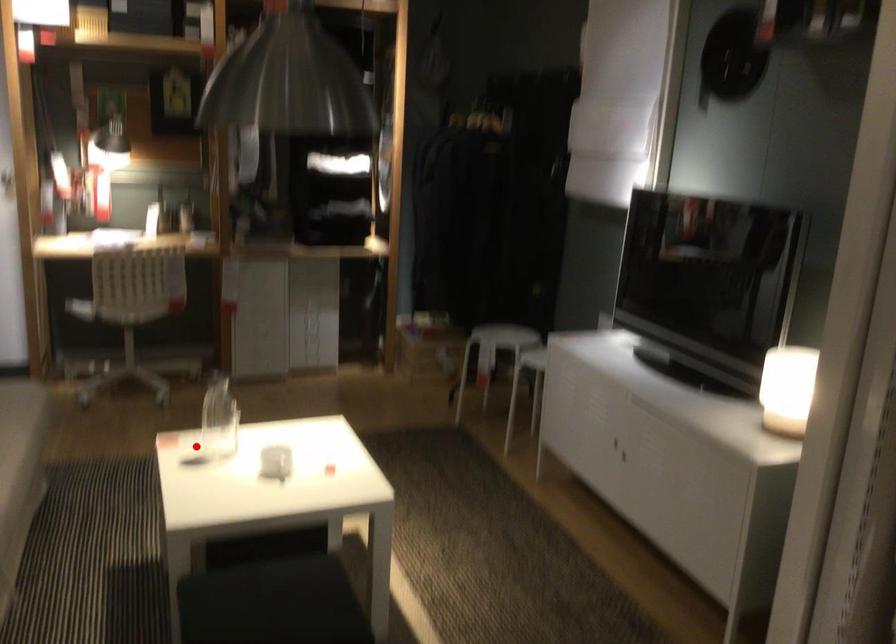
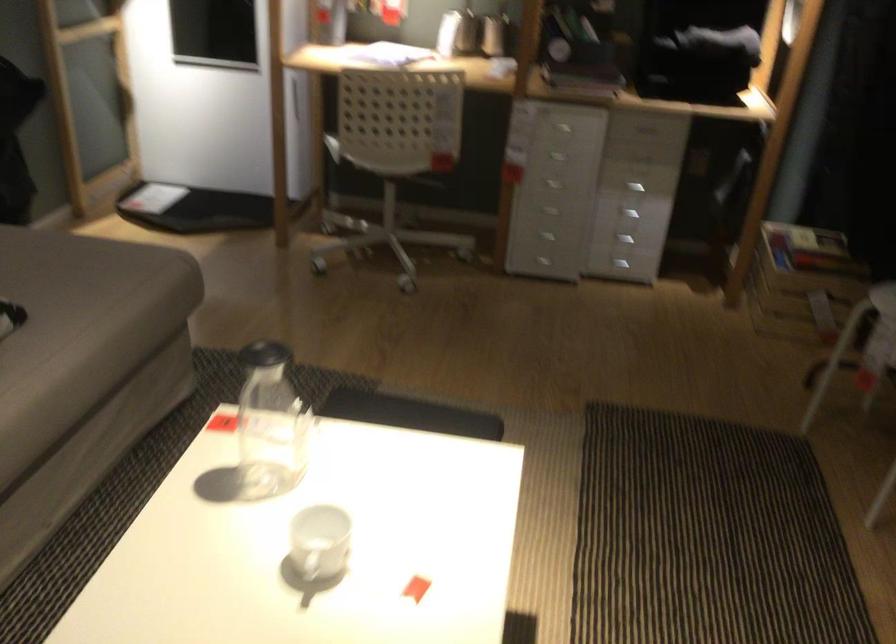
Question: I am providing you with two images of the same scene from different viewpoints. Image1 has a red point marked. In image2, the corresponding 3D location appears at what relative position? Reply with the corresponding letter.

Choices:
 (A) Closer
 (B) Farther

Answer: (A)